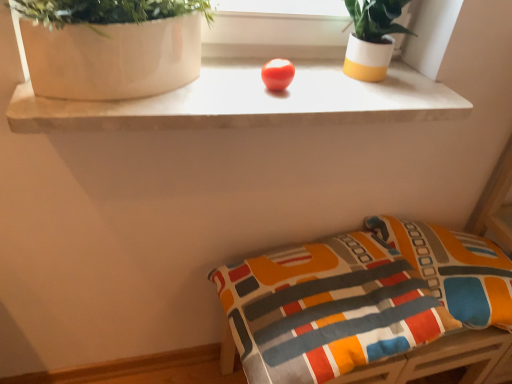
Question: Is the depth of white glossy vase at upper left less than that of white/yellow ceramic pot at upper right?

Choices:
 (A) no
 (B) yes

Answer: (B)

Question: From the image's perspective, is white glossy vase at upper left under white/yellow ceramic pot at upper right?

Choices:
 (A) no
 (B) yes

Answer: (B)

Question: From a real-world perspective, is white glossy vase at upper left under white/yellow ceramic pot at upper right?

Choices:
 (A) no
 (B) yes

Answer: (B)

Question: Is white glossy vase at upper left oriented away from white/yellow ceramic pot at upper right?

Choices:
 (A) no
 (B) yes

Answer: (A)

Question: From a real-world perspective, does white glossy vase at upper left stand above white/yellow ceramic pot at upper right?

Choices:
 (A) yes
 (B) no

Answer: (B)

Question: Considering the positions of point (413, 253) and point (373, 81), is point (413, 253) closer or farther from the camera than point (373, 81)?

Choices:
 (A) closer
 (B) farther

Answer: (B)

Question: Looking at the image, does textured fabric cushion at lower right seem bigger or smaller compared to white/yellow ceramic pot at upper right?

Choices:
 (A) big
 (B) small

Answer: (A)

Question: In terms of height, does textured fabric cushion at lower right look taller or shorter compared to white/yellow ceramic pot at upper right?

Choices:
 (A) short
 (B) tall

Answer: (A)

Question: Is textured fabric cushion at lower right wider or thinner than white/yellow ceramic pot at upper right?

Choices:
 (A) thin
 (B) wide

Answer: (B)

Question: From the image's perspective, is textured fabric cushion at lower right above or below white glossy vase at upper left?

Choices:
 (A) above
 (B) below

Answer: (B)

Question: Is textured fabric cushion at lower right situated inside white glossy vase at upper left or outside?

Choices:
 (A) outside
 (B) inside

Answer: (A)

Question: From a real-world perspective, relative to white glossy vase at upper left, is textured fabric cushion at lower right vertically above or below?

Choices:
 (A) above
 (B) below

Answer: (B)

Question: Relative to white glossy vase at upper left, is textured fabric cushion at lower right in front or behind?

Choices:
 (A) front
 (B) behind

Answer: (B)

Question: In terms of height, does textured fabric pillow at lower right look taller or shorter compared to white/yellow ceramic pot at upper right?

Choices:
 (A) tall
 (B) short

Answer: (B)

Question: Is textured fabric pillow at lower right to the left or to the right of white/yellow ceramic pot at upper right in the image?

Choices:
 (A) left
 (B) right

Answer: (B)